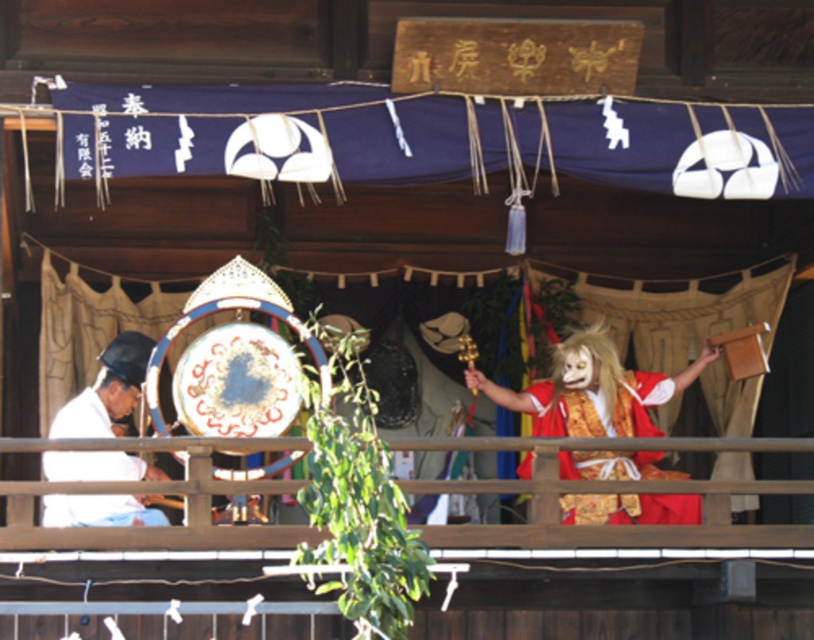
You are standing on the wooden stage at the traditional Japanese festival. You need to locate the red satin kimono at center. Based on the coordinates provided, where exactly should you look to find it?

The red satin kimono at center is located at coordinates point (x=596, y=408).